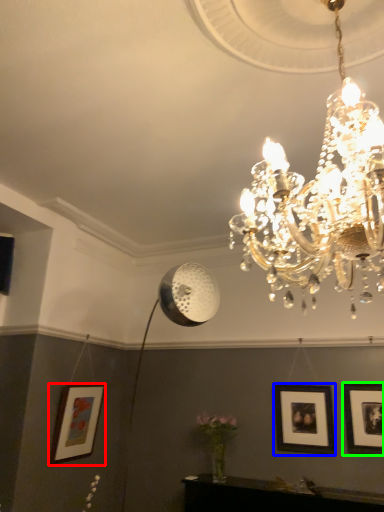
Question: Which is nearer to the picture frame (highlighted by a red box)? picture frame (highlighted by a blue box) or picture frame (highlighted by a green box).

Choices:
 (A) picture frame
 (B) picture frame

Answer: (A)